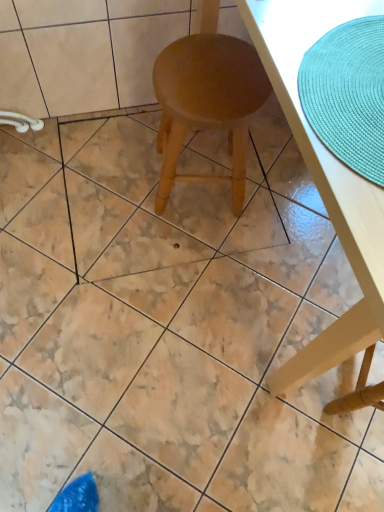
I want to click on spots to the right of light brown wood stool at center, so click(278, 201).